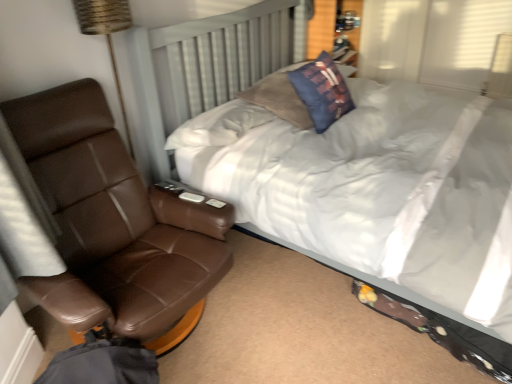
This screenshot has height=384, width=512. What are the coordinates of `blue fabric pillow at upper center` in the screenshot? It's located at (304, 94).

Describe the element at coordinates (304, 94) in the screenshot. Image resolution: width=512 pixels, height=384 pixels. I see `blue fabric pillow at upper center` at that location.

This screenshot has height=384, width=512. What do you see at coordinates (115, 224) in the screenshot? I see `brown leather chair at left` at bounding box center [115, 224].

This screenshot has width=512, height=384. What do you see at coordinates (375, 188) in the screenshot?
I see `white soft bed at center` at bounding box center [375, 188].

This screenshot has width=512, height=384. In order to click on blue fabric pillow at upper center in this screenshot , I will do `click(304, 94)`.

Are blue fabric pillow at upper center and brown leather chair at left far apart?

No, there isn't a large distance between blue fabric pillow at upper center and brown leather chair at left.

Looking at this image, is blue fabric pillow at upper center facing towards brown leather chair at left?

No, blue fabric pillow at upper center is not aimed at brown leather chair at left.

The image size is (512, 384). What are the coordinates of `chair located in front of the blue fabric pillow at upper center` in the screenshot? It's located at point(115,224).

Does point (326, 91) come closer to viewer compared to point (177, 258)?

No, it is not.

Is brown leather chair at left to the left or to the right of blue fabric pillow at upper center in the image?

brown leather chair at left is to the left of blue fabric pillow at upper center.

Is brown leather chair at left with blue fabric pillow at upper center?

brown leather chair at left is not next to blue fabric pillow at upper center, and they're not touching.

Which of these two, brown leather chair at left or blue fabric pillow at upper center, is thinner?

With smaller width is blue fabric pillow at upper center.

Based on their sizes in the image, would you say brown leather chair at left is bigger or smaller than blue fabric pillow at upper center?

brown leather chair at left is bigger than blue fabric pillow at upper center.

From the image's perspective, which is below, blue fabric pillow at upper center or white soft bed at center?

white soft bed at center is shown below in the image.

Is blue fabric pillow at upper center directly adjacent to white soft bed at center?

No, blue fabric pillow at upper center is not touching white soft bed at center.

Measure the distance between blue fabric pillow at upper center and white soft bed at center.

A distance of 13.78 inches exists between blue fabric pillow at upper center and white soft bed at center.

Is blue fabric pillow at upper center outside of white soft bed at center?

No.

Based on the photo, from the image's perspective, is white soft bed at center on blue fabric pillow at upper center?

No, from the image's perspective, white soft bed at center is not above blue fabric pillow at upper center.

From the picture: Which object is positioned more to the left, white soft bed at center or blue fabric pillow at upper center?

From the viewer's perspective, blue fabric pillow at upper center appears more on the left side.

Relative to blue fabric pillow at upper center, is white soft bed at center in front or behind?

In the image, white soft bed at center appears in front of blue fabric pillow at upper center.

Is white soft bed at center oriented towards brown leather chair at left?

No, white soft bed at center is not aimed at brown leather chair at left.

Choose the correct answer: Is white soft bed at center inside brown leather chair at left or outside it?

white soft bed at center is not enclosed by brown leather chair at left.

From a real-world perspective, is white soft bed at center physically above brown leather chair at left?

Yes, from a real-world perspective, white soft bed at center is on top of brown leather chair at left.

Is white soft bed at center in front of brown leather chair at left?

Yes, white soft bed at center is closer to the viewer.

From a real-world perspective, is brown leather chair at left physically located above or below white soft bed at center?

From a real-world perspective, brown leather chair at left is physically below white soft bed at center.

Is brown leather chair at left facing away from white soft bed at center?

brown leather chair at left does not have its back to white soft bed at center.

Is brown leather chair at left at the left side of white soft bed at center?

Indeed, brown leather chair at left is positioned on the left side of white soft bed at center.

Is brown leather chair at left next to white soft bed at center?

No, brown leather chair at left is not in contact with white soft bed at center.

Image resolution: width=512 pixels, height=384 pixels. I want to click on pillow located on the right of brown leather chair at left, so click(x=304, y=94).

The width and height of the screenshot is (512, 384). In order to click on pillow that appears behind the brown leather chair at left in this screenshot , I will do `click(304, 94)`.

Which object lies nearer to the anchor point blue fabric pillow at upper center, brown leather chair at left or white soft bed at center?

white soft bed at center is closer to blue fabric pillow at upper center.

Based on their spatial positions, is blue fabric pillow at upper center or white soft bed at center further from brown leather chair at left?

The object further to brown leather chair at left is blue fabric pillow at upper center.

From the image, which object appears to be farther from brown leather chair at left, white soft bed at center or blue fabric pillow at upper center?

blue fabric pillow at upper center.

Looking at this image, which object lies nearer to the anchor point white soft bed at center, brown leather chair at left or blue fabric pillow at upper center?

Among the two, blue fabric pillow at upper center is located nearer to white soft bed at center.

Considering their positions, is blue fabric pillow at upper center positioned closer to white soft bed at center than brown leather chair at left?

Based on the image, blue fabric pillow at upper center appears to be nearer to white soft bed at center.

When comparing their distances from blue fabric pillow at upper center, does white soft bed at center or brown leather chair at left seem further?

Based on the image, brown leather chair at left appears to be further to blue fabric pillow at upper center.

Find the location of a particular element. This screenshot has width=512, height=384. chair located between white soft bed at center and blue fabric pillow at upper center in the depth direction is located at coordinates click(115, 224).